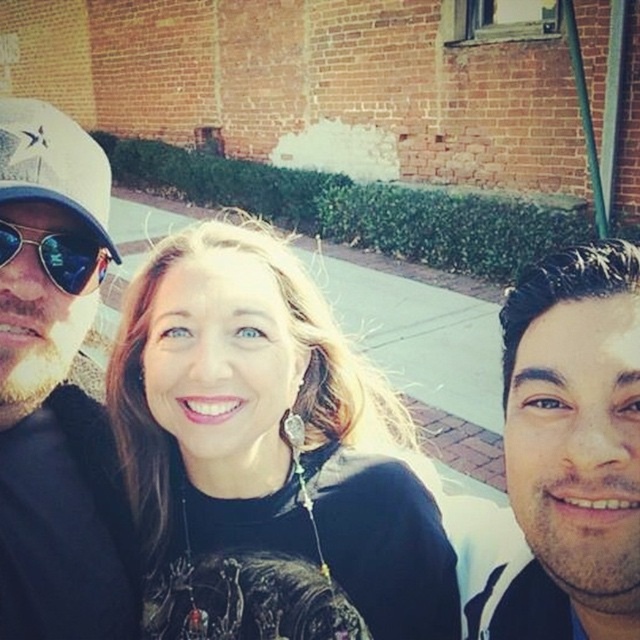
You are trying to identify the position of the two caps in the scene. Which one is more to the left between the matte black cap at left and the white matte baseball cap at left?

The matte black cap at left is positioned on the left side of the white matte baseball cap at left, so the matte black cap at left is more to the left.

You are taking a selfie with two friends. You notice that one friend has a white matte face at right and another wears a white matte baseball cap at left. Based on the scene, which of these two items appears taller in the photo?

The white matte face at right appears taller than the white matte baseball cap at left.

Based on the photo, you are a photographer trying to capture a clear shot of the white matte baseball cap at left and the matte black sunglasses at left. Which object should you focus on first to ensure both are in focus?

You should focus on the white matte baseball cap at left first since it is closer to the viewer than the matte black sunglasses at left, ensuring both will be in focus when starting with the closer object.